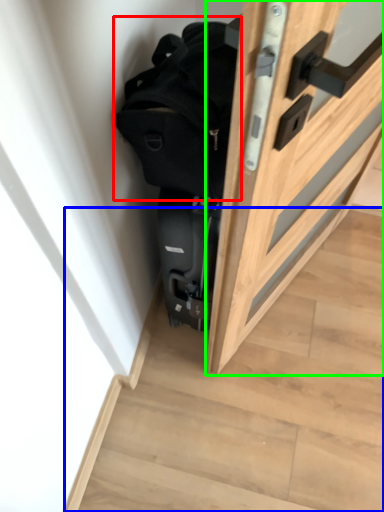
Question: Which is farther away from backpack (highlighted by a red box)? stairwell (highlighted by a blue box) or door (highlighted by a green box)?

Choices:
 (A) stairwell
 (B) door

Answer: (A)